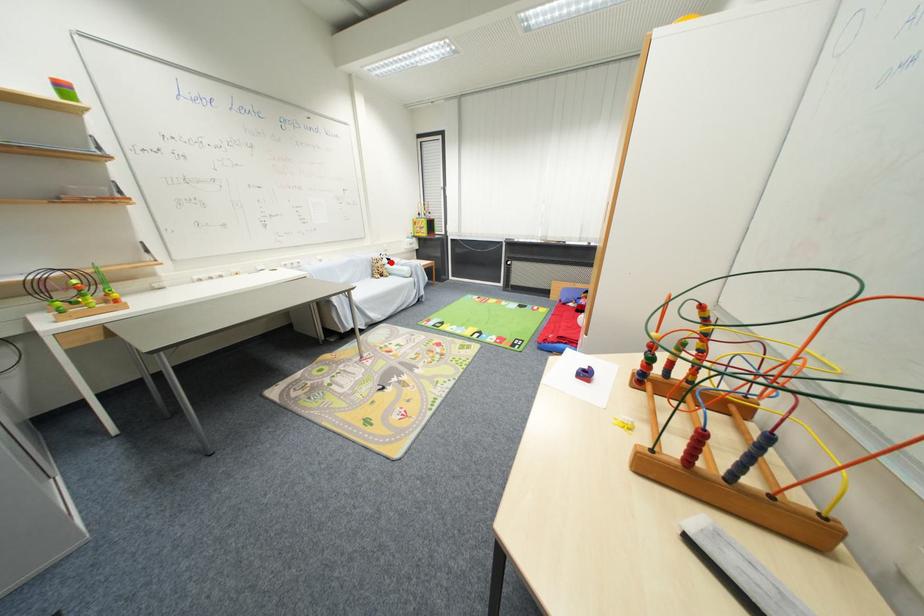
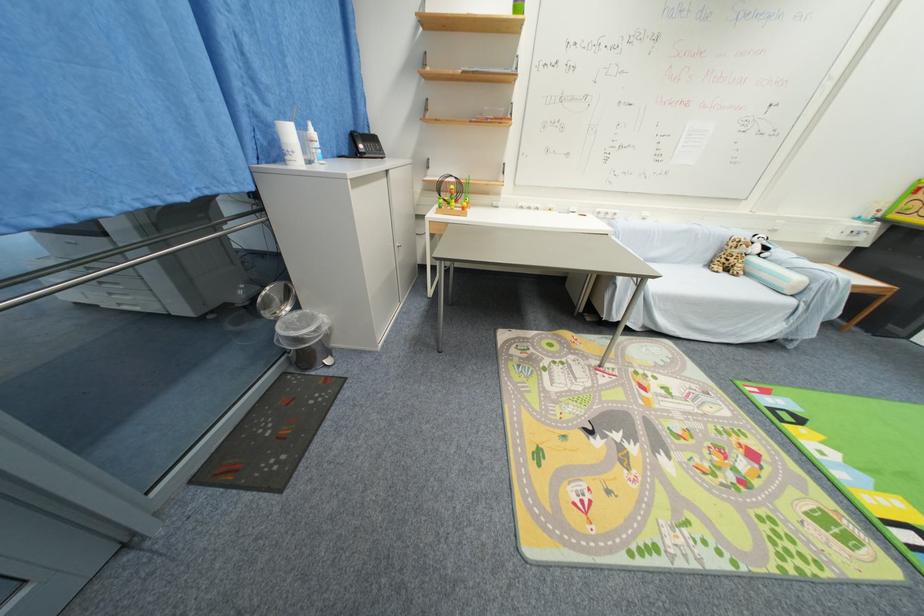
Question: I am providing you with two images of the same scene from different viewpoints. Given a red point in image1, look at the same physical point in image2. Is it:

Choices:
 (A) Closer to the viewpoint
 (B) Farther from the viewpoint

Answer: (B)